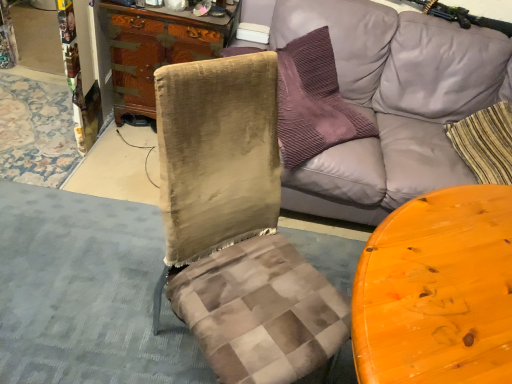
Identify the location of space that is in front of wooden cabinet at center. The height and width of the screenshot is (384, 512). (125, 161).